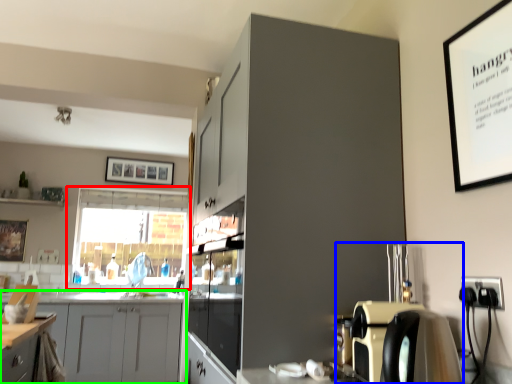
Question: Which object is the closest to the window (highlighted by a red box)? Choose among these: coffee machine (highlighted by a blue box) or cabinetry (highlighted by a green box).

Choices:
 (A) coffee machine
 (B) cabinetry

Answer: (B)